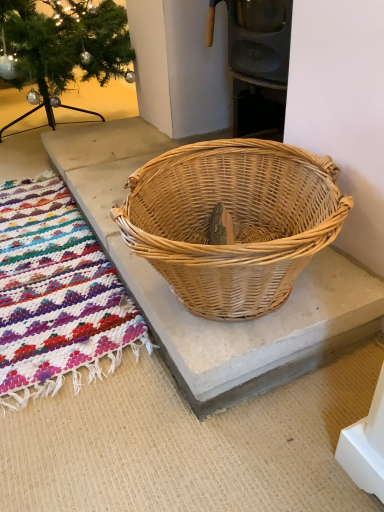
Question: Is natural wicker basket at center further to the viewer compared to multicolored woven mat at lower left?

Choices:
 (A) yes
 (B) no

Answer: (B)

Question: From a real-world perspective, is natural wicker basket at center below multicolored woven mat at lower left?

Choices:
 (A) yes
 (B) no

Answer: (B)

Question: From the image's perspective, would you say natural wicker basket at center is shown under multicolored woven mat at lower left?

Choices:
 (A) yes
 (B) no

Answer: (B)

Question: Is natural wicker basket at center facing towards multicolored woven mat at lower left?

Choices:
 (A) no
 (B) yes

Answer: (A)

Question: Can you confirm if natural wicker basket at center is shorter than multicolored woven mat at lower left?

Choices:
 (A) yes
 (B) no

Answer: (B)

Question: Is natural wicker basket at center smaller than multicolored woven mat at lower left?

Choices:
 (A) yes
 (B) no

Answer: (B)

Question: Is multicolored woven mat at lower left bigger than natural wicker basket at center?

Choices:
 (A) yes
 (B) no

Answer: (B)

Question: Does multicolored woven mat at lower left come in front of natural wicker basket at center?

Choices:
 (A) yes
 (B) no

Answer: (B)

Question: Is multicolored woven mat at lower left looking in the opposite direction of natural wicker basket at center?

Choices:
 (A) yes
 (B) no

Answer: (B)

Question: From the image's perspective, does multicolored woven mat at lower left appear lower than natural wicker basket at center?

Choices:
 (A) yes
 (B) no

Answer: (A)

Question: From a real-world perspective, is multicolored woven mat at lower left below natural wicker basket at center?

Choices:
 (A) yes
 (B) no

Answer: (A)

Question: From the image's perspective, is multicolored woven mat at lower left located above natural wicker basket at center?

Choices:
 (A) no
 (B) yes

Answer: (A)

Question: In terms of width, does natural wicker basket at center look wider or thinner when compared to multicolored woven mat at lower left?

Choices:
 (A) wide
 (B) thin

Answer: (A)